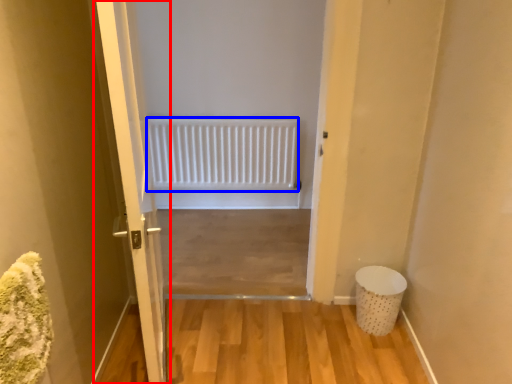
Question: Among these objects, which one is farthest to the camera, door (highlighted by a red box) or radiator (highlighted by a blue box)?

Choices:
 (A) door
 (B) radiator

Answer: (B)